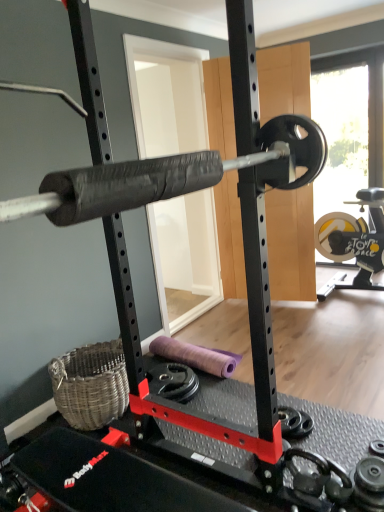
Question: Is black rubber dumbbell at lower right smaller than transparent glass window at upper right?

Choices:
 (A) no
 (B) yes

Answer: (B)

Question: From the image's perspective, is black rubber dumbbell at lower right on top of transparent glass window at upper right?

Choices:
 (A) yes
 (B) no

Answer: (B)

Question: Is black rubber dumbbell at lower right aimed at transparent glass window at upper right?

Choices:
 (A) yes
 (B) no

Answer: (B)

Question: From a real-world perspective, is black rubber dumbbell at lower right on top of transparent glass window at upper right?

Choices:
 (A) no
 (B) yes

Answer: (A)

Question: Is black rubber dumbbell at lower right looking in the opposite direction of transparent glass window at upper right?

Choices:
 (A) no
 (B) yes

Answer: (A)

Question: Is there a large distance between black rubber dumbbell at lower right and transparent glass window at upper right?

Choices:
 (A) yes
 (B) no

Answer: (A)

Question: Is black rubber dumbbell at lower right at the back of transparent glass window at upper right?

Choices:
 (A) yes
 (B) no

Answer: (B)

Question: Considering the relative sizes of transparent glass window at upper right and black rubber dumbbell at lower right in the image provided, is transparent glass window at upper right wider than black rubber dumbbell at lower right?

Choices:
 (A) yes
 (B) no

Answer: (B)

Question: Is transparent glass window at upper right shorter than black rubber dumbbell at lower right?

Choices:
 (A) no
 (B) yes

Answer: (A)

Question: Does transparent glass window at upper right turn towards black rubber dumbbell at lower right?

Choices:
 (A) no
 (B) yes

Answer: (B)

Question: Is the position of transparent glass window at upper right less distant than that of black rubber dumbbell at lower right?

Choices:
 (A) yes
 (B) no

Answer: (B)

Question: Is transparent glass window at upper right far from black rubber dumbbell at lower right?

Choices:
 (A) no
 (B) yes

Answer: (B)

Question: Is black rubber dumbbell at lower right inside or outside of transparent glass window at upper right?

Choices:
 (A) outside
 (B) inside

Answer: (A)